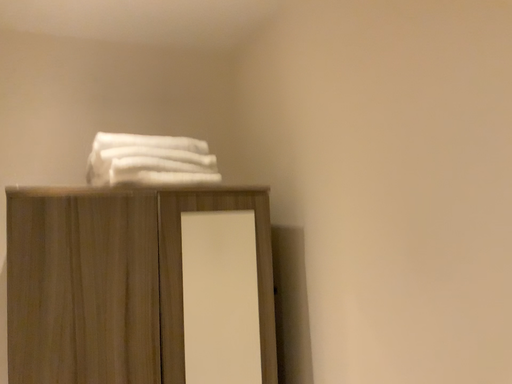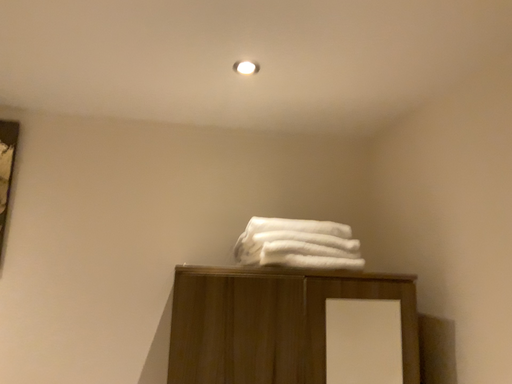
Question: How did the camera likely rotate when shooting the video?

Choices:
 (A) rotated upward
 (B) rotated downward

Answer: (A)